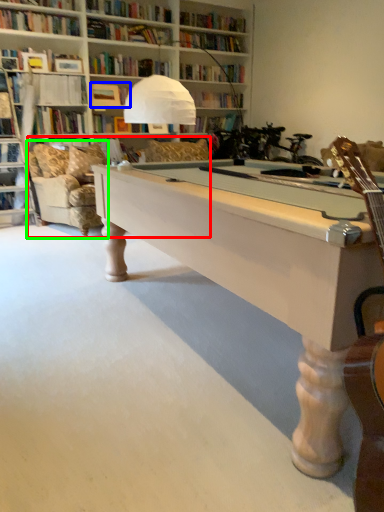
Question: Which is farther away from couch (highlighted by a red box)? book (highlighted by a blue box) or swivel chair (highlighted by a green box)?

Choices:
 (A) book
 (B) swivel chair

Answer: (A)